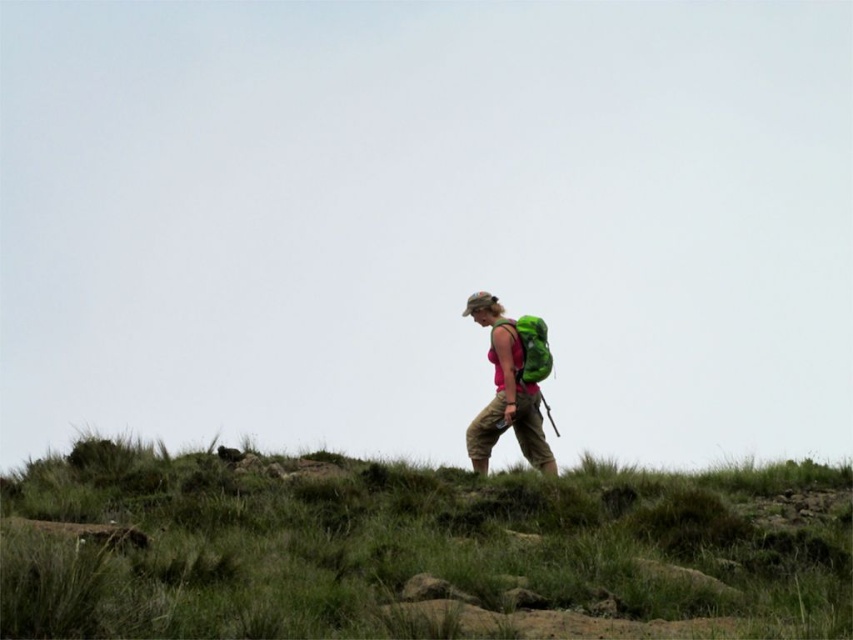
Question: Which object is the closest to the green grassy hillside at center?

Choices:
 (A) green fabric backpack at center-right
 (B) green fabric backpack at right

Answer: (A)

Question: Is green grassy hillside at center thinner than green fabric backpack at center-right?

Choices:
 (A) yes
 (B) no

Answer: (B)

Question: Which point is closer to the camera taking this photo?

Choices:
 (A) (480, 433)
 (B) (810, 467)
 (C) (524, 326)

Answer: (B)

Question: Is green fabric backpack at center-right positioned behind green fabric backpack at right?

Choices:
 (A) no
 (B) yes

Answer: (B)

Question: Which point is closer to the camera taking this photo?

Choices:
 (A) (639, 572)
 (B) (531, 381)
 (C) (508, 321)

Answer: (A)

Question: Is green grassy hillside at center positioned at the back of green fabric backpack at center-right?

Choices:
 (A) yes
 (B) no

Answer: (B)